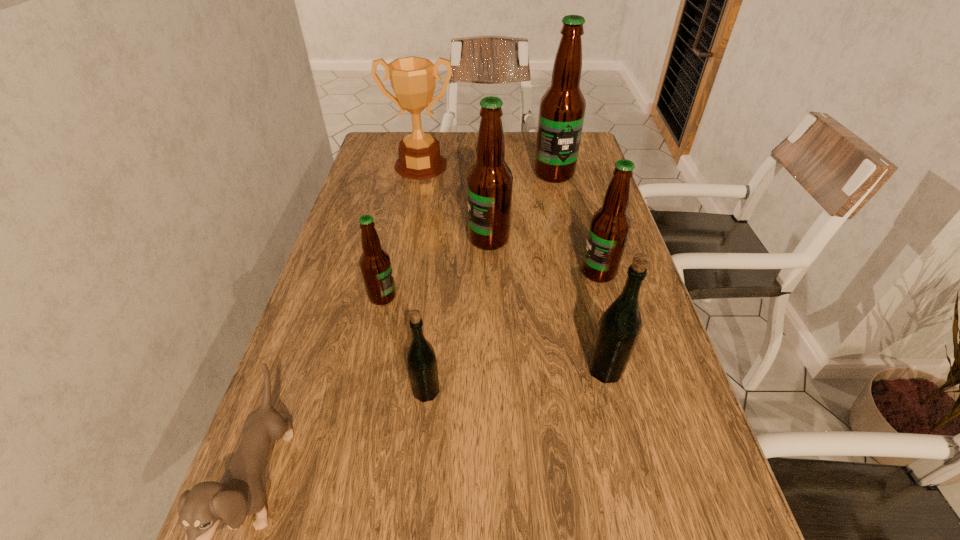
This screenshot has height=540, width=960. In order to click on free space located 0.360m on the left of the bigger green beer bottle in this screenshot , I will do `click(407, 370)`.

You are a GUI agent. You are given a task and a screenshot of the screen. Output one action in this format:
    pyautogui.click(x=<x>, y=<y>)
    Task: Click on the vacant area situated 0.270m on the label of the smallest brown beer bottle
    Image resolution: width=960 pixels, height=540 pixels.
    Given the screenshot: What is the action you would take?
    pyautogui.click(x=513, y=296)

At what (x,y) coordinates should I click in order to perform the action: click on free space located on the back of the second beer bottle from left to right. Please return your answer as a coordinate pair (x, y). Image resolution: width=960 pixels, height=540 pixels. Looking at the image, I should click on (437, 288).

I want to click on beer bottle located in the far edge section of the desktop, so [x=562, y=108].

I want to click on award present at the far edge, so (x=413, y=81).

At what (x,y) coordinates should I click in order to perform the action: click on award located in the left edge section of the desktop. Please return your answer as a coordinate pair (x, y). The height and width of the screenshot is (540, 960). Looking at the image, I should click on (413, 81).

The image size is (960, 540). Find the location of `beer bottle that is positioned at the left edge`. beer bottle that is positioned at the left edge is located at coordinates (375, 264).

You are a GUI agent. You are given a task and a screenshot of the screen. Output one action in this format:
    pyautogui.click(x=<x>, y=<y>)
    Task: Click on the object situated at the far left corner
    
    Given the screenshot: What is the action you would take?
    pyautogui.click(x=413, y=81)

Where is `object present at the far right corner`? This screenshot has width=960, height=540. object present at the far right corner is located at coordinates (562, 108).

You are a GUI agent. You are given a task and a screenshot of the screen. Output one action in this format:
    pyautogui.click(x=<x>, y=<y>)
    Task: Click on the vacant region at the far edge of the desktop
    The width and height of the screenshot is (960, 540).
    Given the screenshot: What is the action you would take?
    pyautogui.click(x=509, y=143)